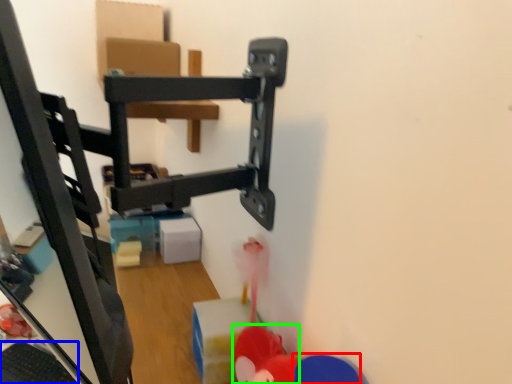
Question: Which object is the farthest from toy (highlighted by a red box)? Choose among these: keyboard (highlighted by a blue box) or toy (highlighted by a green box).

Choices:
 (A) keyboard
 (B) toy

Answer: (A)